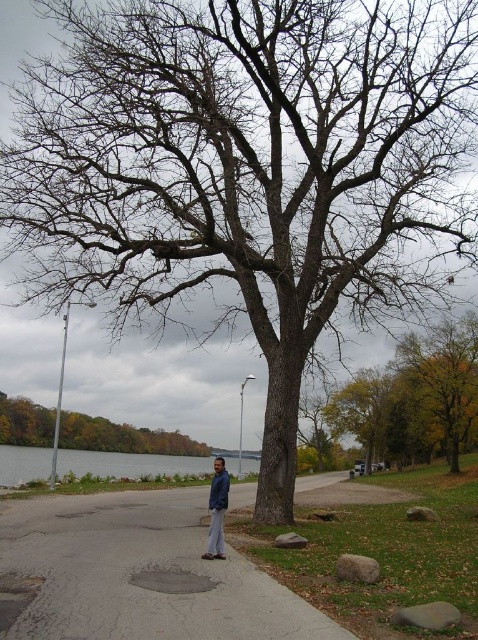
Between gray asphalt sidewalk at center and green leafy tree at upper right, which one is positioned lower?

green leafy tree at upper right is lower down.

Locate an element on the screen. This screenshot has height=640, width=478. gray asphalt sidewalk at center is located at coordinates (141, 573).

I want to click on gray asphalt sidewalk at center, so click(x=141, y=573).

Who is higher up, gray asphalt sidewalk at center or blue denim jacket at center?

gray asphalt sidewalk at center

Is gray asphalt sidewalk at center positioned before blue denim jacket at center?

That is True.

This screenshot has width=478, height=640. What are the coordinates of `gray asphalt sidewalk at center` in the screenshot? It's located at (141, 573).

Does green leafy tree at upper right appear under blue denim jacket at center?

Yes.

Image resolution: width=478 pixels, height=640 pixels. Find the location of `green leafy tree at upper right`. green leafy tree at upper right is located at coordinates (415, 397).